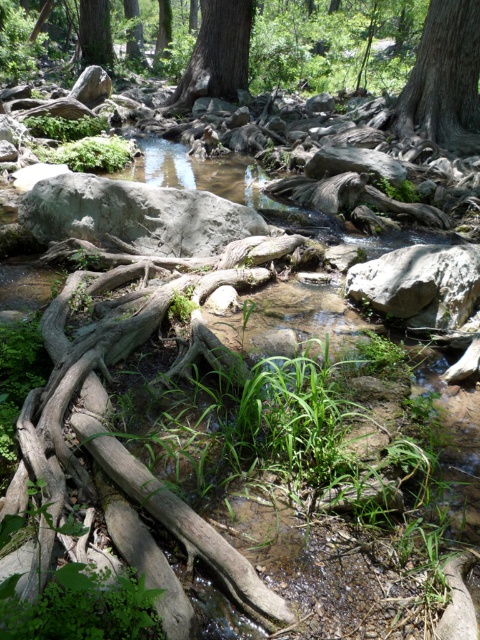
Question: Does smooth gray bark at upper right have a smaller size compared to smooth brown tree trunk at upper center?

Choices:
 (A) yes
 (B) no

Answer: (A)

Question: Among these objects, which one is farthest from the camera?

Choices:
 (A) gray rough rock at center-right
 (B) brown rough tree roots at center
 (C) smooth brown tree trunk at upper center
 (D) gray rough boulder at center

Answer: (C)

Question: Is brown rough tree roots at center positioned in front of smooth brown tree trunk at upper center?

Choices:
 (A) no
 (B) yes

Answer: (B)

Question: Does gray rough boulder at center have a lesser width compared to gray rough rock at center-right?

Choices:
 (A) no
 (B) yes

Answer: (A)

Question: Among these points, which one is farthest from the camera?

Choices:
 (A) (211, 0)
 (B) (430, 54)

Answer: (A)

Question: Which point is closer to the camera?

Choices:
 (A) smooth gray bark at upper right
 (B) gray rough boulder at center
 (C) smooth brown tree trunk at upper center
 (D) brown rough tree roots at center

Answer: (D)